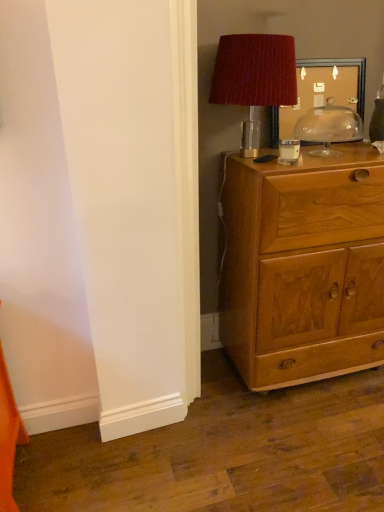
Question: Does transparent glass dome at upper right have a larger size compared to velvet red lampshade at upper right?

Choices:
 (A) yes
 (B) no

Answer: (B)

Question: Is transparent glass dome at upper right not near velvet red lampshade at upper right?

Choices:
 (A) no
 (B) yes

Answer: (A)

Question: Is transparent glass dome at upper right thinner than velvet red lampshade at upper right?

Choices:
 (A) yes
 (B) no

Answer: (A)

Question: From the image's perspective, would you say transparent glass dome at upper right is shown under velvet red lampshade at upper right?

Choices:
 (A) yes
 (B) no

Answer: (A)

Question: Can you confirm if transparent glass dome at upper right is shorter than velvet red lampshade at upper right?

Choices:
 (A) yes
 (B) no

Answer: (A)

Question: From a real-world perspective, is transparent glass dome at upper right on top of velvet red lampshade at upper right?

Choices:
 (A) yes
 (B) no

Answer: (B)

Question: Is wooden cabinet at right positioned far away from velvet red lampshade at upper right?

Choices:
 (A) yes
 (B) no

Answer: (B)

Question: Considering the relative sizes of wooden cabinet at right and velvet red lampshade at upper right in the image provided, is wooden cabinet at right smaller than velvet red lampshade at upper right?

Choices:
 (A) yes
 (B) no

Answer: (B)

Question: Does wooden cabinet at right turn towards velvet red lampshade at upper right?

Choices:
 (A) no
 (B) yes

Answer: (A)

Question: Is wooden cabinet at right not within velvet red lampshade at upper right?

Choices:
 (A) yes
 (B) no

Answer: (A)

Question: Does wooden cabinet at right have a lesser height compared to velvet red lampshade at upper right?

Choices:
 (A) yes
 (B) no

Answer: (B)

Question: Is wooden cabinet at right positioned before velvet red lampshade at upper right?

Choices:
 (A) yes
 (B) no

Answer: (B)

Question: From a real-world perspective, does wooden picture frame at upper right stand above transparent glass dome at upper right?

Choices:
 (A) yes
 (B) no

Answer: (A)